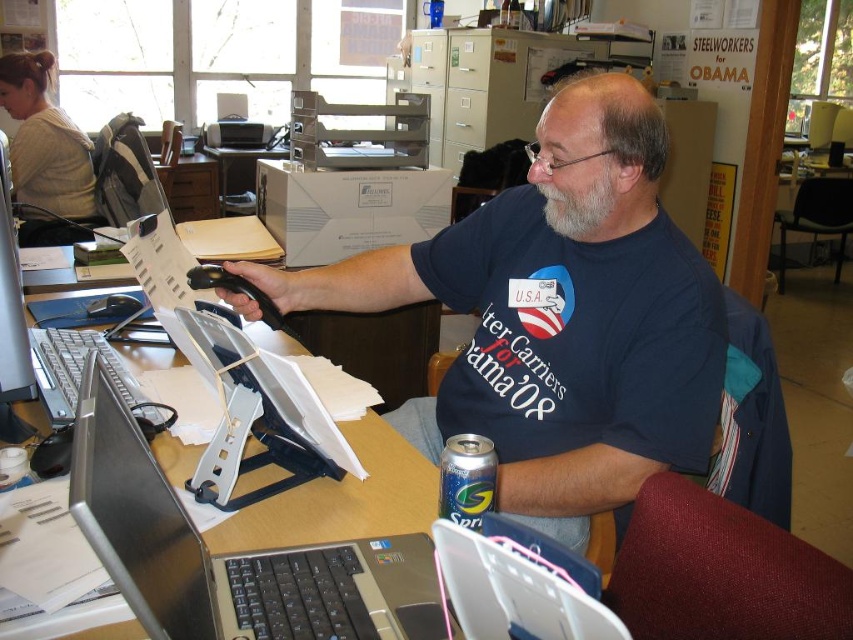
Question: Which of these objects is positioned farthest from the blue cotton t-shirt at center?

Choices:
 (A) blue metallic can at lower center
 (B) matte black monitor at left
 (C) silver metallic laptop at center
 (D) gray/soft hair at center

Answer: (B)

Question: Is silver metallic laptop at center above gray/soft hair at center?

Choices:
 (A) yes
 (B) no

Answer: (B)

Question: Based on their relative distances, which object is farther from the gray/soft hair at center?

Choices:
 (A) blue cotton t-shirt at center
 (B) matte black monitor at left
 (C) silver metallic laptop at center
 (D) blue metallic can at lower center

Answer: (B)

Question: Which object is closer to the camera taking this photo?

Choices:
 (A) gray/soft hair at center
 (B) blue metallic can at lower center

Answer: (B)

Question: Can you confirm if silver metallic laptop at center is positioned below blue metallic can at lower center?

Choices:
 (A) no
 (B) yes

Answer: (B)

Question: Does silver metallic laptop at center appear under matte black monitor at left?

Choices:
 (A) no
 (B) yes

Answer: (B)